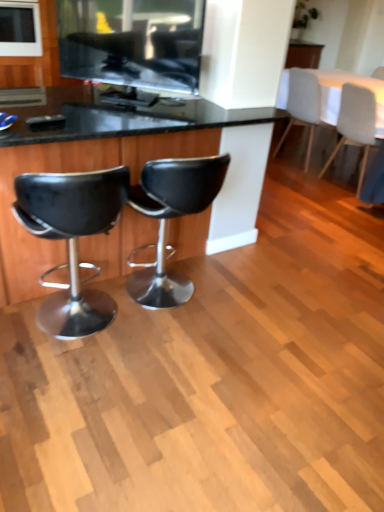
Question: Is black leather stool at center, marked as the 2th chair in a front-to-back arrangement, smaller than black leather desk at center?

Choices:
 (A) no
 (B) yes

Answer: (B)

Question: Does black leather stool at center, marked as the 2th chair in a front-to-back arrangement, lie in front of black leather desk at center?

Choices:
 (A) yes
 (B) no

Answer: (B)

Question: Is black leather stool at center, positioned as the third chair in right-to-left order, not close to black leather desk at center?

Choices:
 (A) yes
 (B) no

Answer: (B)

Question: From the image's perspective, is black leather stool at center, positioned as the 2th chair in left-to-right order, over black leather desk at center?

Choices:
 (A) yes
 (B) no

Answer: (B)

Question: Is black leather stool at center, which ranks as the 3th chair in back-to-front order, taller than black leather desk at center?

Choices:
 (A) no
 (B) yes

Answer: (A)

Question: From the image's perspective, is black leather stool at center, marked as the 2th chair in a front-to-back arrangement, below black leather desk at center?

Choices:
 (A) yes
 (B) no

Answer: (A)

Question: Can you confirm if white fabric chair at upper right, the fourth chair positioned from the left, is smaller than white fabric table at upper right?

Choices:
 (A) yes
 (B) no

Answer: (A)

Question: Considering the relative sizes of white fabric chair at upper right, which is counted as the 3th chair, starting from the front, and white fabric table at upper right in the image provided, is white fabric chair at upper right, which is counted as the 3th chair, starting from the front, thinner than white fabric table at upper right?

Choices:
 (A) yes
 (B) no

Answer: (A)

Question: From the image's perspective, is white fabric chair at upper right, which appears as the 1th chair when viewed from the right, beneath white fabric table at upper right?

Choices:
 (A) yes
 (B) no

Answer: (A)

Question: From a real-world perspective, is white fabric chair at upper right, which is counted as the 3th chair, starting from the front, on top of white fabric table at upper right?

Choices:
 (A) yes
 (B) no

Answer: (B)

Question: Could white fabric table at upper right be considered to be inside white fabric chair at upper right, the second chair positioned from the back?

Choices:
 (A) yes
 (B) no

Answer: (B)

Question: Is white fabric chair at upper right, the second chair positioned from the back, closer to camera compared to white fabric table at upper right?

Choices:
 (A) no
 (B) yes

Answer: (B)

Question: Is white glossy microwave at upper left, the 1th appliance viewed from the back, not close to matte black tv at upper center, the first appliance in the front-to-back sequence?

Choices:
 (A) no
 (B) yes

Answer: (B)